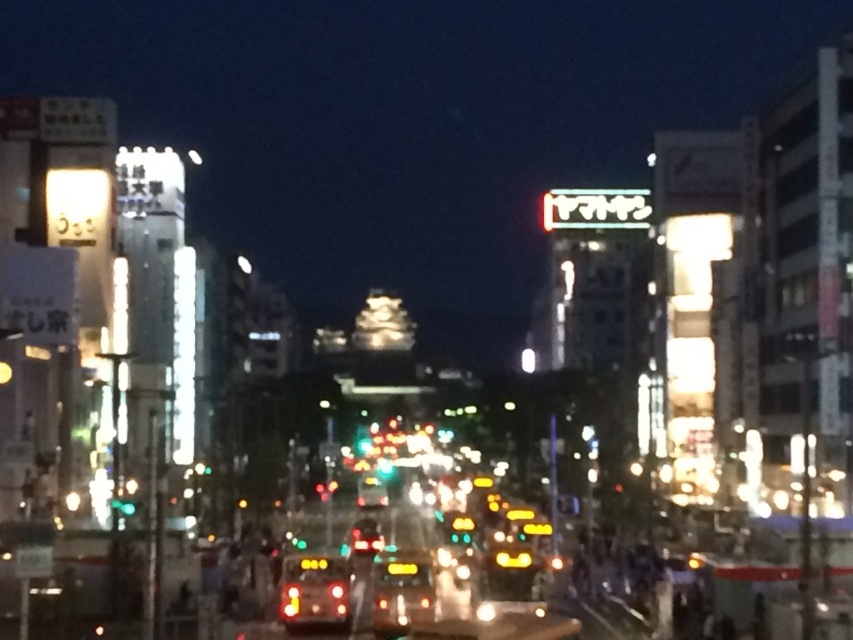
Who is positioned more to the right, matte yellow taxi at center or yellow reflective taxi at center?

From the viewer's perspective, yellow reflective taxi at center appears more on the right side.

Who is lower down, matte yellow taxi at center or yellow reflective taxi at center?

yellow reflective taxi at center is lower down.

The height and width of the screenshot is (640, 853). What do you see at coordinates (312, 589) in the screenshot? I see `matte yellow taxi at center` at bounding box center [312, 589].

You are a GUI agent. You are given a task and a screenshot of the screen. Output one action in this format:
    pyautogui.click(x=<x>, y=<y>)
    Task: Click on the matte yellow taxi at center
    The width and height of the screenshot is (853, 640).
    Given the screenshot: What is the action you would take?
    pyautogui.click(x=312, y=589)